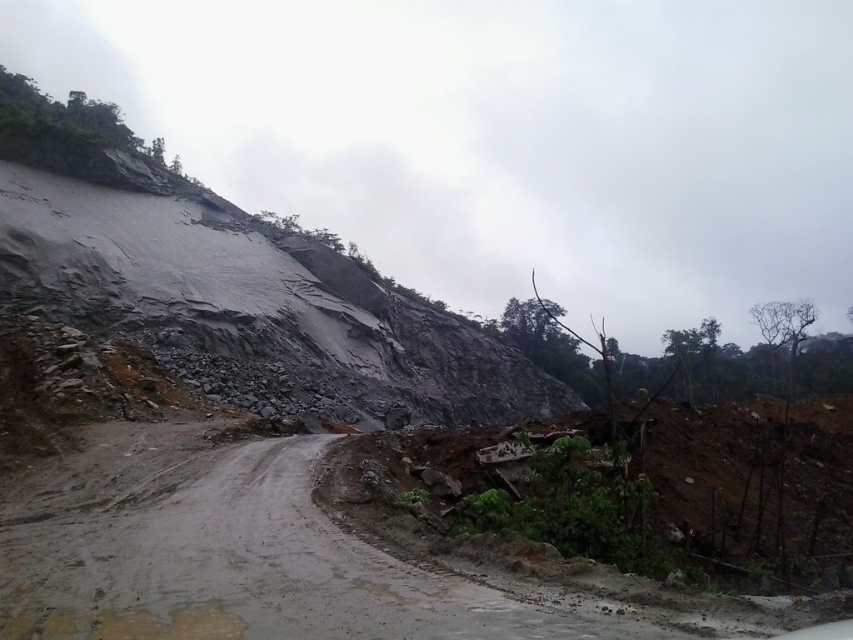
Question: Among these points, which one is farthest from the camera?

Choices:
 (A) (77, 579)
 (B) (4, 225)

Answer: (B)

Question: Which of the following is the farthest from the observer?

Choices:
 (A) (521, 356)
 (B) (537, 611)

Answer: (A)

Question: Is muddy concrete dirt track at center below gray rock at upper left?

Choices:
 (A) yes
 (B) no

Answer: (A)

Question: Is muddy concrete dirt track at center bigger than gray rock at upper left?

Choices:
 (A) yes
 (B) no

Answer: (B)

Question: Observing the image, what is the correct spatial positioning of muddy concrete dirt track at center in reference to gray rock at upper left?

Choices:
 (A) left
 (B) right

Answer: (B)